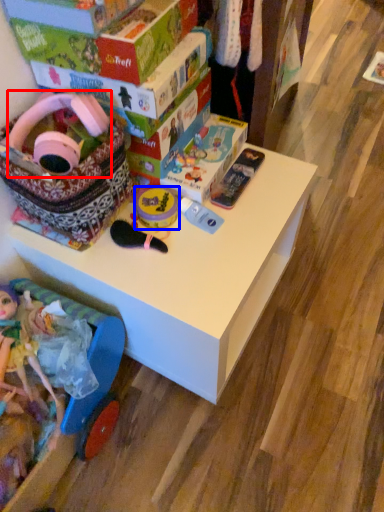
Question: Which of the following is the farthest to the observer, toy (highlighted by a red box) or toy (highlighted by a blue box)?

Choices:
 (A) toy
 (B) toy

Answer: (B)